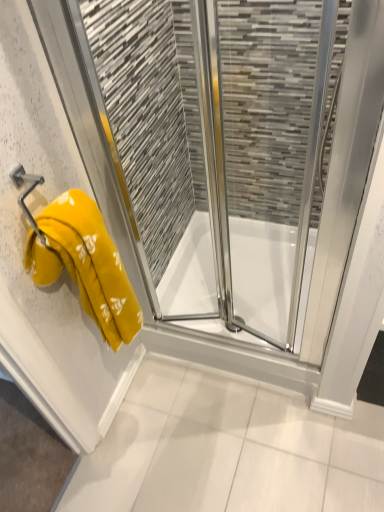
Question: Is metallic yellow towel bar at left placed right next to yellow towel at left?

Choices:
 (A) no
 (B) yes

Answer: (A)

Question: From the image's perspective, would you say metallic yellow towel bar at left is shown under yellow towel at left?

Choices:
 (A) no
 (B) yes

Answer: (A)

Question: Is metallic yellow towel bar at left not inside yellow towel at left?

Choices:
 (A) yes
 (B) no

Answer: (A)

Question: Is metallic yellow towel bar at left to the right of yellow towel at left from the viewer's perspective?

Choices:
 (A) yes
 (B) no

Answer: (B)

Question: Is metallic yellow towel bar at left far away from yellow towel at left?

Choices:
 (A) yes
 (B) no

Answer: (B)

Question: Would you say transparent glass shower at center is to the left or to the right of yellow fabric towel at left in the picture?

Choices:
 (A) right
 (B) left

Answer: (A)

Question: From the image's perspective, is transparent glass shower at center above or below yellow fabric towel at left?

Choices:
 (A) above
 (B) below

Answer: (B)

Question: Does point (256, 228) appear closer or farther from the camera than point (69, 249)?

Choices:
 (A) farther
 (B) closer

Answer: (A)

Question: Based on their sizes in the image, would you say transparent glass shower at center is bigger or smaller than yellow fabric towel at left?

Choices:
 (A) small
 (B) big

Answer: (B)

Question: Relative to transparent glass shower at center, is yellow fabric towel at left in front or behind?

Choices:
 (A) front
 (B) behind

Answer: (A)

Question: From the image's perspective, is yellow fabric towel at left positioned above or below transparent glass shower at center?

Choices:
 (A) below
 (B) above

Answer: (B)

Question: Is yellow fabric towel at left taller or shorter than transparent glass shower at center?

Choices:
 (A) tall
 (B) short

Answer: (A)

Question: Is point [x=29, y=248] positioned closer to the camera than point [x=284, y=337]?

Choices:
 (A) closer
 (B) farther

Answer: (A)

Question: From the image's perspective, is metallic yellow towel bar at left located above or below yellow fabric towel at left?

Choices:
 (A) above
 (B) below

Answer: (A)

Question: Is metallic yellow towel bar at left bigger or smaller than yellow fabric towel at left?

Choices:
 (A) small
 (B) big

Answer: (A)